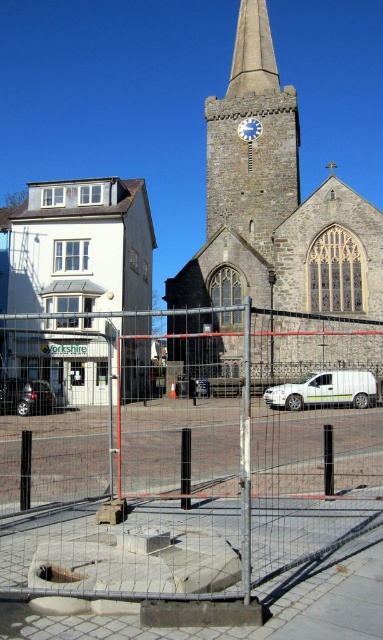
You are a construction worker assessing the site of the historic church. You need to ensure that the white matte building at left and the blue metallic clock at center are visible from a new observation deck being built. Given their heights, which object will appear taller when viewed from the deck?

The white matte building at left is taller than the blue metallic clock at center, so it will appear taller when viewed from the observation deck.

In the scene shown: You are a delivery driver approaching the white matte building at left and the white matte van at center. Which one is more to the left?

The white matte building at left is more to the left side of the white matte van at center.